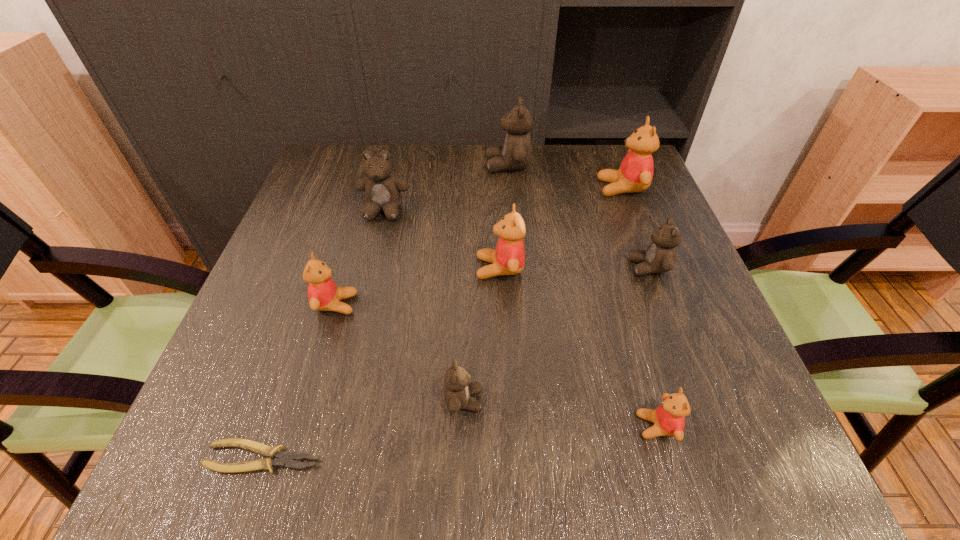
Select which red teddy bear appears as the fourth closest to the third nearest brown teddy bear. Please provide its 2D coordinates. Your answer should be formatted as a tuple, i.e. [(x, y)], where the tuple contains the x and y coordinates of a point satisfying the conditions above.

[(669, 418)]